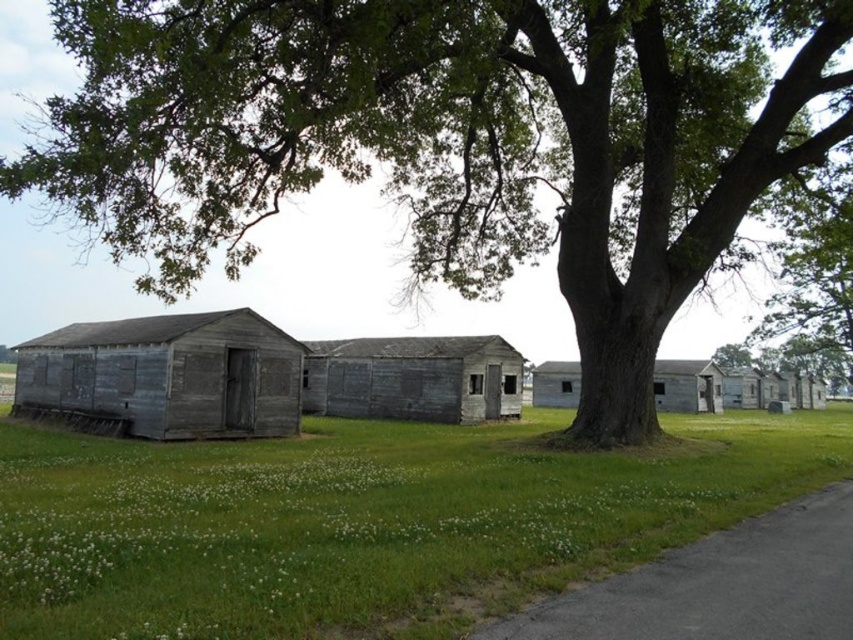
You are standing in the rural scene and want to take a photo of both point (480, 602) and point (425, 387). Which point should you focus on first to ensure both are in clear view?

You should focus on point (480, 602) first because it is closer to the camera, ensuring both points will be in focus when using a proper depth of field.

You are planning to set up a picnic blanket. You want to ensure it is under the shade of the green leafy tree at center but also close to the weathered wood hut at center. Is the tree wide enough to provide shade over the picnic blanket placed near the hut?

The green leafy tree at center might be wider than weathered wood hut at center, so it is possible that the tree could provide sufficient shade over the picnic blanket placed near the hut.